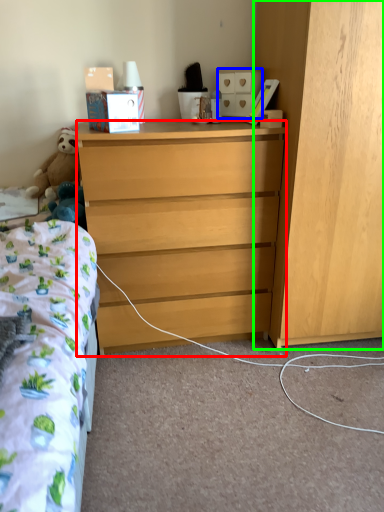
Question: Considering the real-world distances, which object is farthest from desk (highlighted by a red box)? cabinetry (highlighted by a blue box) or cabinetry (highlighted by a green box)?

Choices:
 (A) cabinetry
 (B) cabinetry

Answer: (A)